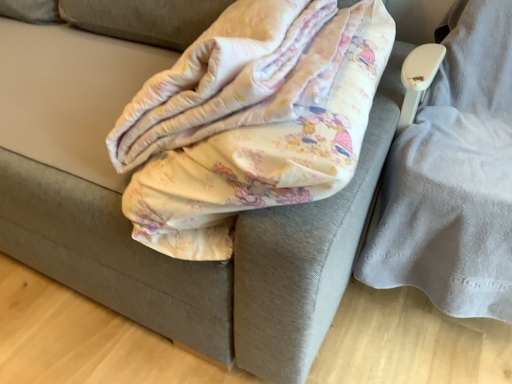
What do you see at coordinates (257, 124) in the screenshot? I see `fluffy cotton blanket at center` at bounding box center [257, 124].

Measure the distance between point [341,179] and camera.

54.50 centimeters.

Identify the location of fluffy cotton blanket at center. Image resolution: width=512 pixels, height=384 pixels. (257, 124).

I want to click on gray fabric swivel chair at right, so click(x=454, y=176).

What do you see at coordinates (454, 176) in the screenshot? The width and height of the screenshot is (512, 384). I see `gray fabric swivel chair at right` at bounding box center [454, 176].

Where is `fluffy cotton blanket at center`? Image resolution: width=512 pixels, height=384 pixels. fluffy cotton blanket at center is located at coordinates (257, 124).

Would you say gray fabric swivel chair at right is to the left or to the right of fluffy cotton blanket at center in the picture?

gray fabric swivel chair at right is positioned on fluffy cotton blanket at center's right side.

Which object is further away from the camera, gray fabric swivel chair at right or fluffy cotton blanket at center?

Positioned behind is gray fabric swivel chair at right.

Is point (477, 225) less distant than point (213, 102)?

No, it is not.

From the image's perspective, which one is positioned lower, gray fabric swivel chair at right or fluffy cotton blanket at center?

gray fabric swivel chair at right.

From a real-world perspective, is gray fabric swivel chair at right located beneath fluffy cotton blanket at center?

Indeed, from a real-world perspective, gray fabric swivel chair at right is positioned beneath fluffy cotton blanket at center.

Between gray fabric swivel chair at right and fluffy cotton blanket at center, which one has larger width?

With larger width is fluffy cotton blanket at center.

In terms of height, does gray fabric swivel chair at right look taller or shorter compared to fluffy cotton blanket at center?

In the image, gray fabric swivel chair at right appears to be taller than fluffy cotton blanket at center.

Between gray fabric swivel chair at right and fluffy cotton blanket at center, which one has larger size?

gray fabric swivel chair at right is bigger.

Is gray fabric swivel chair at right not inside fluffy cotton blanket at center?

Absolutely, gray fabric swivel chair at right is external to fluffy cotton blanket at center.

In the scene shown: Is gray fabric swivel chair at right placed right next to fluffy cotton blanket at center?

There is a gap between gray fabric swivel chair at right and fluffy cotton blanket at center.

Is gray fabric swivel chair at right positioned with its back to fluffy cotton blanket at center?

No, gray fabric swivel chair at right is not facing away from fluffy cotton blanket at center.

Where is `swivel chair behind the fluffy cotton blanket at center`? This screenshot has height=384, width=512. swivel chair behind the fluffy cotton blanket at center is located at coordinates (454, 176).

Between fluffy cotton blanket at center and gray fabric swivel chair at right, which one appears on the left side from the viewer's perspective?

Positioned to the left is fluffy cotton blanket at center.

Is fluffy cotton blanket at center further to camera compared to gray fabric swivel chair at right?

No, fluffy cotton blanket at center is closer to the camera.

Is point (232, 85) closer to viewer compared to point (477, 217)?

Yes, point (232, 85) is closer to viewer.

From the image's perspective, which is below, fluffy cotton blanket at center or gray fabric swivel chair at right?

gray fabric swivel chair at right appears lower in the image.

From a real-world perspective, who is located higher, fluffy cotton blanket at center or gray fabric swivel chair at right?

fluffy cotton blanket at center is physically above.

Which object is wider, fluffy cotton blanket at center or gray fabric swivel chair at right?

With larger width is fluffy cotton blanket at center.

From the picture: Between fluffy cotton blanket at center and gray fabric swivel chair at right, which one has more height?

gray fabric swivel chair at right is taller.

Between fluffy cotton blanket at center and gray fabric swivel chair at right, which one has smaller size?

Smaller between the two is fluffy cotton blanket at center.

Is fluffy cotton blanket at center not inside gray fabric swivel chair at right?

Yes, fluffy cotton blanket at center is located beyond the bounds of gray fabric swivel chair at right.

Is fluffy cotton blanket at center not near gray fabric swivel chair at right?

That's not correct — fluffy cotton blanket at center is a little close to gray fabric swivel chair at right.

Does fluffy cotton blanket at center turn towards gray fabric swivel chair at right?

No, fluffy cotton blanket at center is not facing towards gray fabric swivel chair at right.

Can you tell me how much fluffy cotton blanket at center and gray fabric swivel chair at right differ in facing direction?

They differ by 90.4 degrees in their facing directions.

In the image, there is a gray fabric swivel chair at right. Where is `blanket above it (from the image's perspective)`? The height and width of the screenshot is (384, 512). blanket above it (from the image's perspective) is located at coordinates (257, 124).

The height and width of the screenshot is (384, 512). I want to click on blanket above the gray fabric swivel chair at right (from a real-world perspective), so click(257, 124).

Identify the location of swivel chair behind the fluffy cotton blanket at center. This screenshot has height=384, width=512. (454, 176).